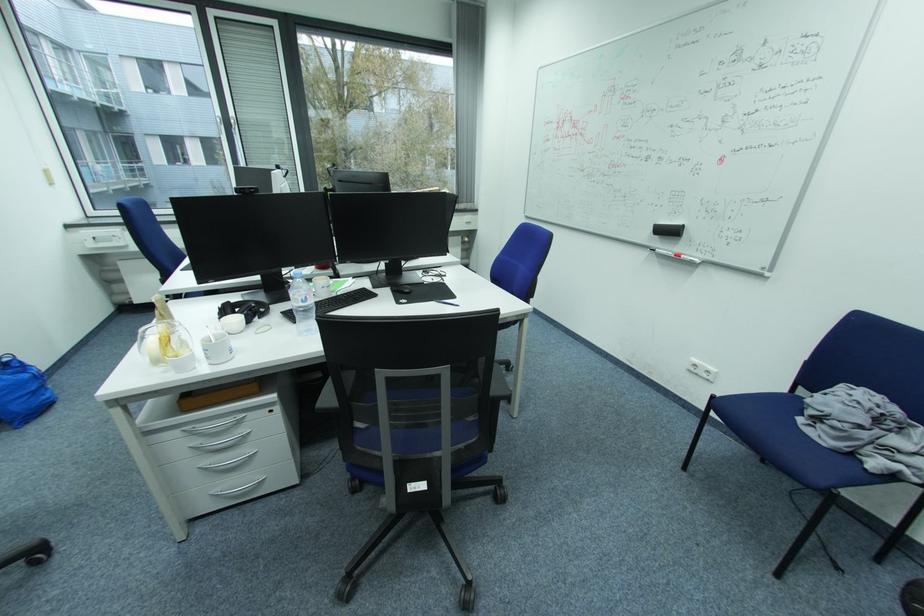
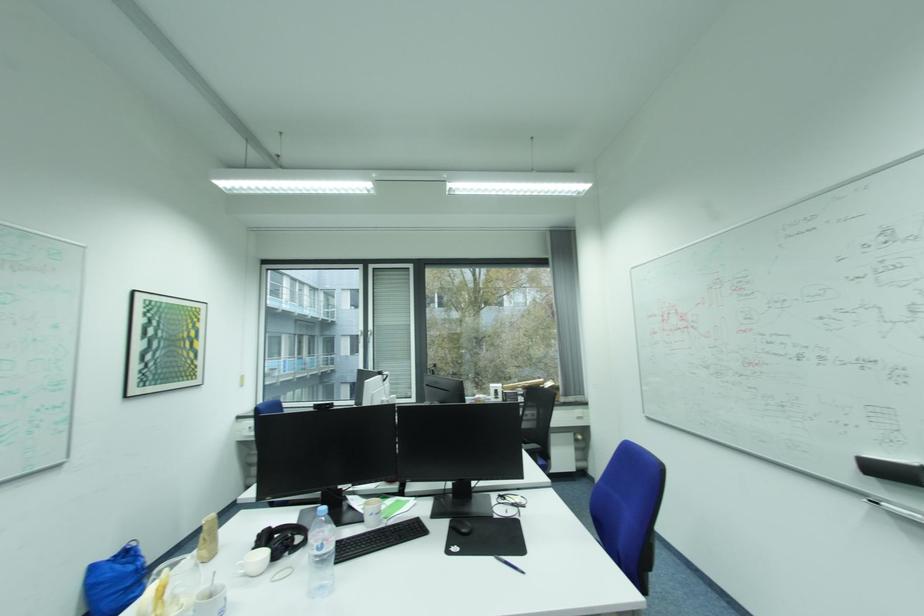
Find the pixel in the second image that matches point 213,341 in the first image.

(205, 596)